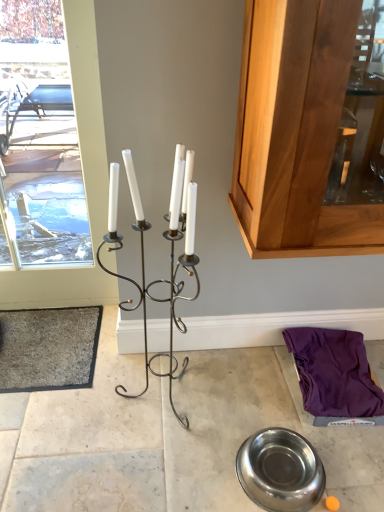
I want to click on vacant area on top of gray carpet at lower left (from a real-world perspective), so click(39, 343).